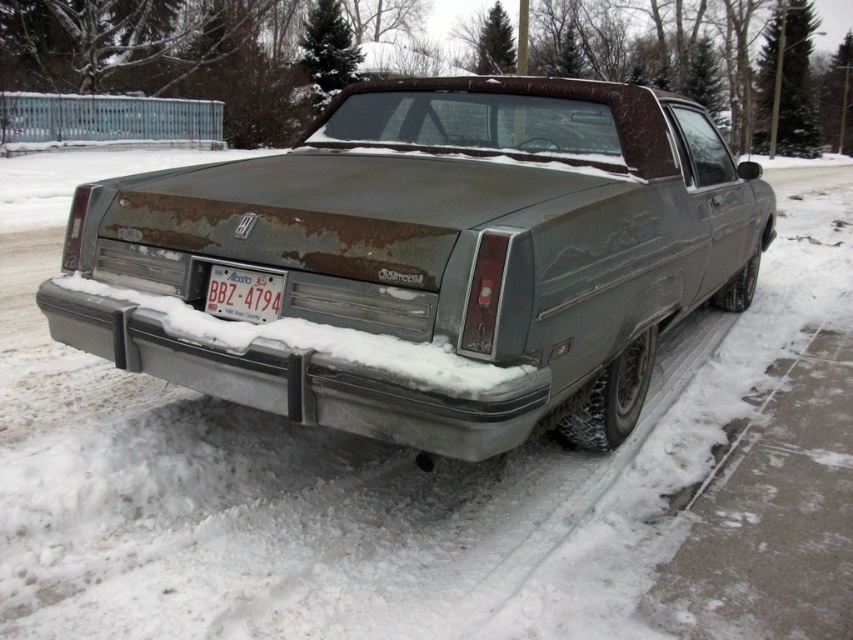
Is rusty metal car at center further to camera compared to white plastic license plate at center?

No, it is not.

Can you confirm if rusty metal car at center is thinner than white plastic license plate at center?

No.

Identify the location of rusty metal car at center. Image resolution: width=853 pixels, height=640 pixels. (438, 253).

What are the coordinates of `rusty metal car at center` in the screenshot? It's located at (438, 253).